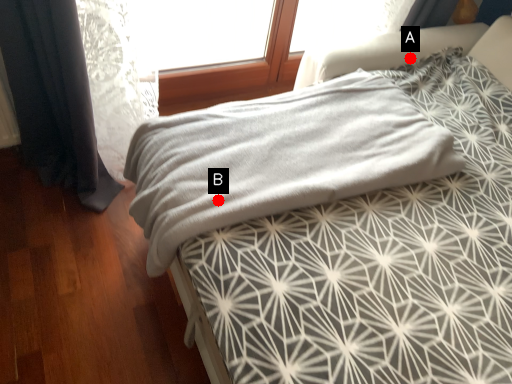
Question: Two points are circled on the image, labeled by A and B beside each circle. Which point is further to the camera?

Choices:
 (A) A is further
 (B) B is further

Answer: (A)